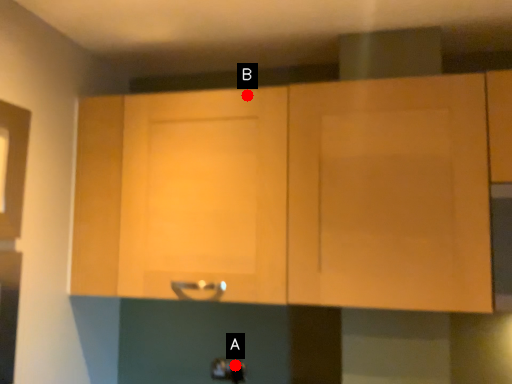
Question: Two points are circled on the image, labeled by A and B beside each circle. Which point is further to the camera?

Choices:
 (A) A is further
 (B) B is further

Answer: (A)